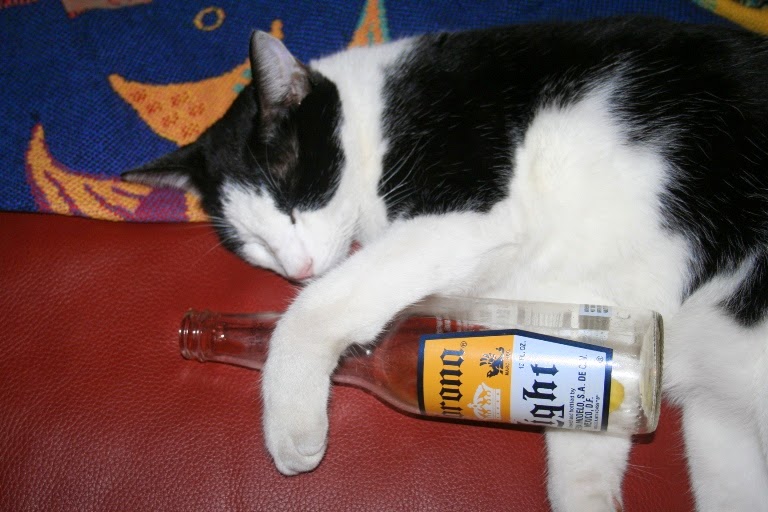
Locate an element on the screen. The image size is (768, 512). bottle is located at coordinates (465, 349).